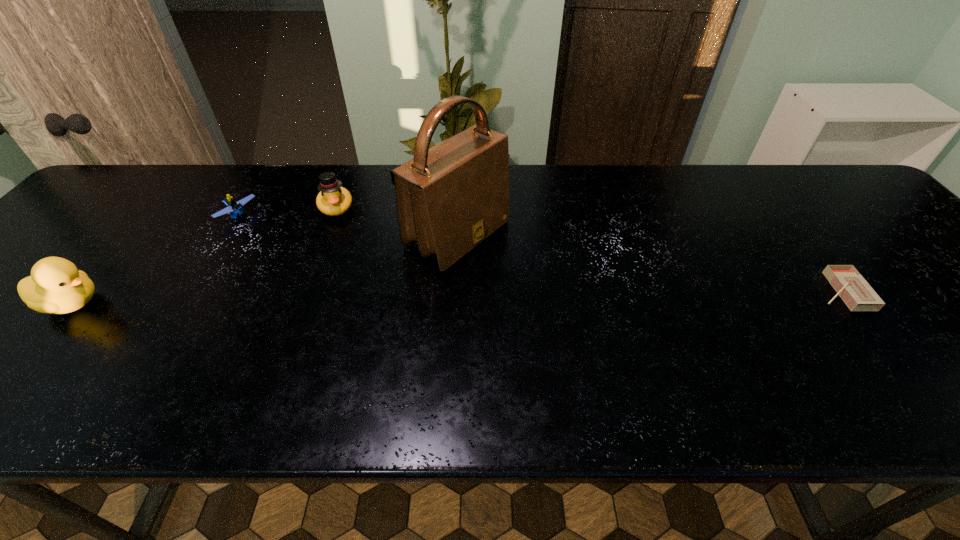
Image resolution: width=960 pixels, height=540 pixels. In the image, there is a desktop. What are the coordinates of `vacant space at the right edge` in the screenshot? It's located at (855, 214).

This screenshot has height=540, width=960. In order to click on empty space that is in between the tallest object and the right duck in this screenshot , I will do (397, 221).

Where is `free space between the tallest object and the right duck`? This screenshot has height=540, width=960. free space between the tallest object and the right duck is located at coordinates (397, 221).

You are a GUI agent. You are given a task and a screenshot of the screen. Output one action in this format:
    pyautogui.click(x=<x>, y=<y>)
    Task: Click on the vacant area between the shoulder bag and the Lego
    This screenshot has width=960, height=540.
    Given the screenshot: What is the action you would take?
    pyautogui.click(x=348, y=226)

You are a GUI agent. You are given a task and a screenshot of the screen. Output one action in this format:
    pyautogui.click(x=<x>, y=<y>)
    Task: Click on the vacant area that lies between the farther duck and the Lego
    This screenshot has width=960, height=540.
    Given the screenshot: What is the action you would take?
    pyautogui.click(x=287, y=212)

This screenshot has width=960, height=540. Identify the location of free spot between the Lego and the rightmost object. pyautogui.click(x=540, y=253).

I want to click on blank region between the shortest object and the leftmost object, so click(x=456, y=297).

Where is `free space that is in between the third object from left to right and the rightmost object`? The height and width of the screenshot is (540, 960). free space that is in between the third object from left to right and the rightmost object is located at coordinates (588, 249).

Where is `vacant area that lies between the third object from right to left and the second object from left to right`? This screenshot has height=540, width=960. vacant area that lies between the third object from right to left and the second object from left to right is located at coordinates (287, 212).

Locate an element on the screen. The image size is (960, 540). vacant area that lies between the matchbox and the left duck is located at coordinates pyautogui.click(x=456, y=297).